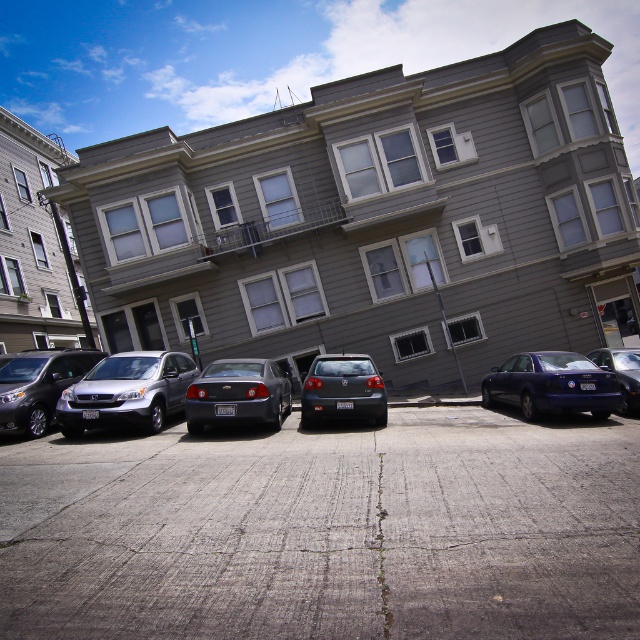
Who is positioned more to the left, silver metallic minivan at left or shiny black sedan at right?

silver metallic minivan at left is more to the left.

Which is in front, point (32, 410) or point (637, 403)?

Point (32, 410)

The height and width of the screenshot is (640, 640). In order to click on silver metallic minivan at left in this screenshot , I will do `click(38, 385)`.

Is shiny dark blue sedan at center right positioned at the back of matte black sedan at center?

Yes, it is.

Does shiny dark blue sedan at center right appear on the right side of matte black sedan at center?

Yes, shiny dark blue sedan at center right is to the right of matte black sedan at center.

I want to click on shiny dark blue sedan at center right, so click(552, 385).

Which is in front, point (365, 417) or point (593, 360)?

Point (365, 417) is more forward.

Can you confirm if matte black sedan at center is wider than shiny black sedan at right?

Yes.

Locate an element on the screen. This screenshot has width=640, height=640. matte black sedan at center is located at coordinates (342, 388).